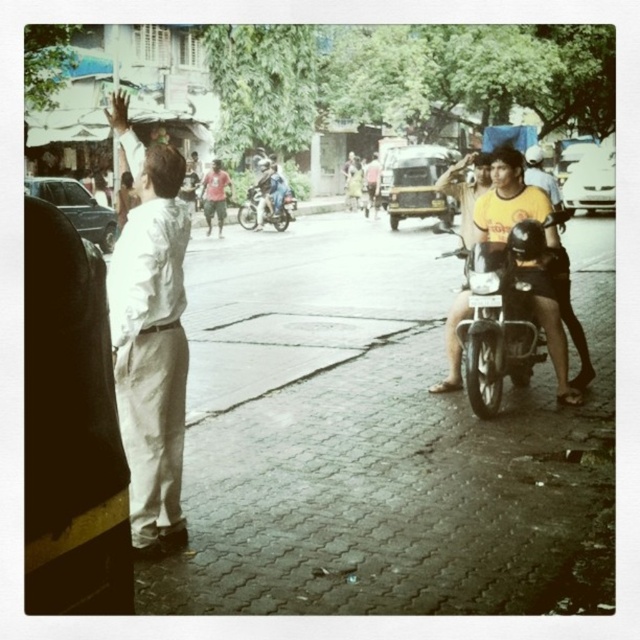
Question: Which point appears farthest from the camera in this image?

Choices:
 (A) pos(541,246)
 (B) pos(252,227)

Answer: (B)

Question: Which of these objects is positioned farthest from the white shirt at left?

Choices:
 (A) metallic silver motorcycle at center
 (B) black matte motorcycle at center-right

Answer: (A)

Question: Does white shirt at left have a smaller size compared to black matte motorcycle at center-right?

Choices:
 (A) yes
 (B) no

Answer: (B)

Question: Which point is closer to the camera?

Choices:
 (A) black matte motorcycle at center-right
 (B) white shirt at left

Answer: (B)

Question: Where is white shirt at left located in relation to black matte motorcycle at center-right in the image?

Choices:
 (A) left
 (B) right

Answer: (A)

Question: Can you confirm if white shirt at left is positioned to the left of black matte motorcycle at center-right?

Choices:
 (A) yes
 (B) no

Answer: (A)